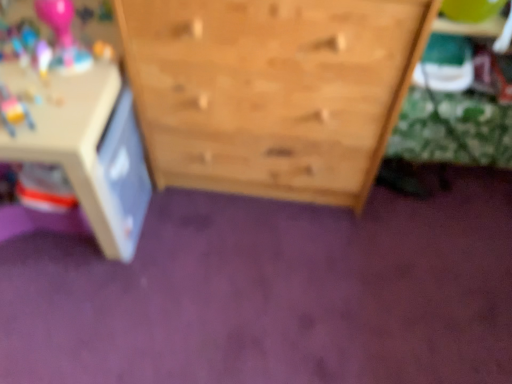
Question: From a real-world perspective, is white plastic table at left located beneath natural wood chest of drawers at center?

Choices:
 (A) yes
 (B) no

Answer: (A)

Question: Can you confirm if white plastic table at left is thinner than natural wood chest of drawers at center?

Choices:
 (A) yes
 (B) no

Answer: (B)

Question: Could you tell me if white plastic table at left is facing natural wood chest of drawers at center?

Choices:
 (A) no
 (B) yes

Answer: (A)

Question: Is there a large distance between white plastic table at left and natural wood chest of drawers at center?

Choices:
 (A) no
 (B) yes

Answer: (A)

Question: Is the position of white plastic table at left less distant than that of natural wood chest of drawers at center?

Choices:
 (A) no
 (B) yes

Answer: (A)

Question: Does white plastic table at left appear on the right side of natural wood chest of drawers at center?

Choices:
 (A) no
 (B) yes

Answer: (A)

Question: Is natural wood chest of drawers at center looking in the opposite direction of white plastic table at left?

Choices:
 (A) yes
 (B) no

Answer: (B)

Question: Is natural wood chest of drawers at center taller than white plastic table at left?

Choices:
 (A) no
 (B) yes

Answer: (B)

Question: Is natural wood chest of drawers at center located outside white plastic table at left?

Choices:
 (A) yes
 (B) no

Answer: (A)

Question: Is the position of natural wood chest of drawers at center more distant than that of white plastic table at left?

Choices:
 (A) yes
 (B) no

Answer: (B)

Question: Is natural wood chest of drawers at center in front of white plastic table at left?

Choices:
 (A) yes
 (B) no

Answer: (A)

Question: Does natural wood chest of drawers at center contain white plastic table at left?

Choices:
 (A) yes
 (B) no

Answer: (B)

Question: Choose the correct answer: Is white plastic table at left inside natural wood chest of drawers at center or outside it?

Choices:
 (A) inside
 (B) outside

Answer: (B)